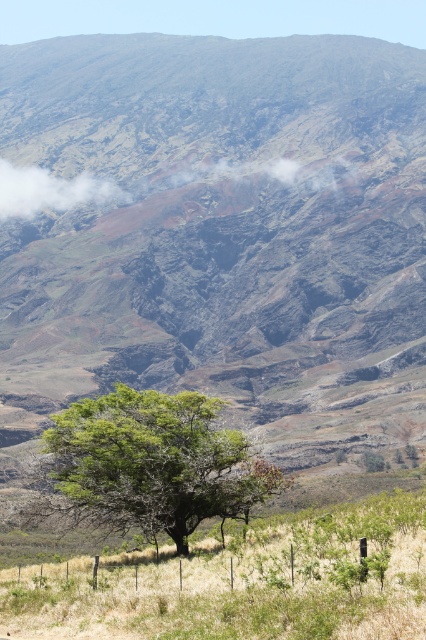
Between green leafy tree at center and white fluffy cloud at upper center, which one is positioned lower?

green leafy tree at center is lower down.

The image size is (426, 640). What do you see at coordinates (149, 465) in the screenshot?
I see `green leafy tree at center` at bounding box center [149, 465].

Is point (183, 419) farther from camera compared to point (279, 164)?

That is False.

In order to click on green leafy tree at center in this screenshot , I will do `click(149, 465)`.

Between dry grass at center and white fluffy cloud at upper center, which one appears on the left side from the viewer's perspective?

white fluffy cloud at upper center is more to the left.

Locate an element on the screen. dry grass at center is located at coordinates (x=247, y=584).

What do you see at coordinates (247, 584) in the screenshot? I see `dry grass at center` at bounding box center [247, 584].

Locate an element on the screen. The width and height of the screenshot is (426, 640). dry grass at center is located at coordinates (x=247, y=584).

Can you confirm if dry grass at center is taller than green leafy tree at center?

Incorrect, dry grass at center's height is not larger of green leafy tree at center's.

Where is `dry grass at center`? dry grass at center is located at coordinates (247, 584).

Identify the location of dry grass at center. This screenshot has width=426, height=640. (247, 584).

Find the location of `dry grass at center`. dry grass at center is located at coordinates (247, 584).